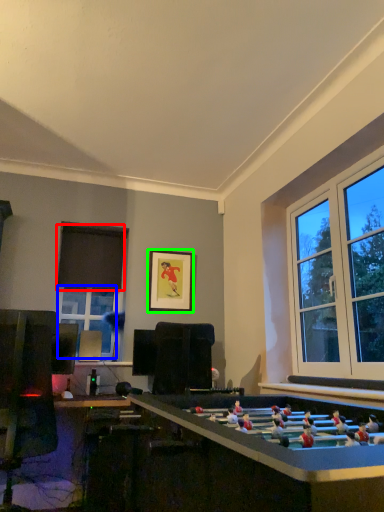
Question: Which object is the farthest from curtain (highlighted by a red box)? Choose among these: window (highlighted by a blue box) or picture frame (highlighted by a green box).

Choices:
 (A) window
 (B) picture frame

Answer: (B)